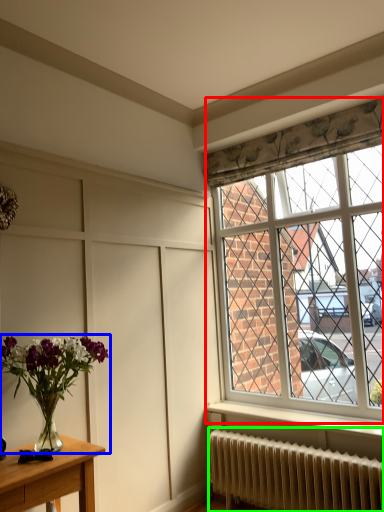
Question: Estimate the real-world distances between objects in this image. Which object is closer to window (highlighted by a red box), houseplant (highlighted by a blue box) or radiator (highlighted by a green box)?

Choices:
 (A) houseplant
 (B) radiator

Answer: (B)